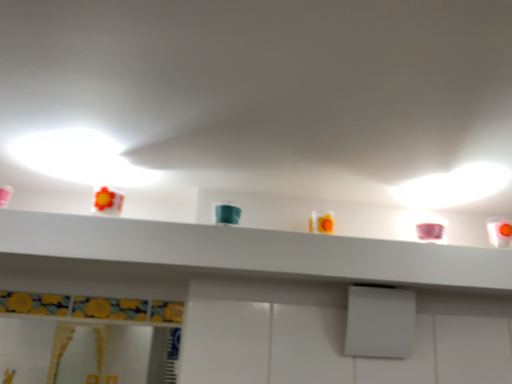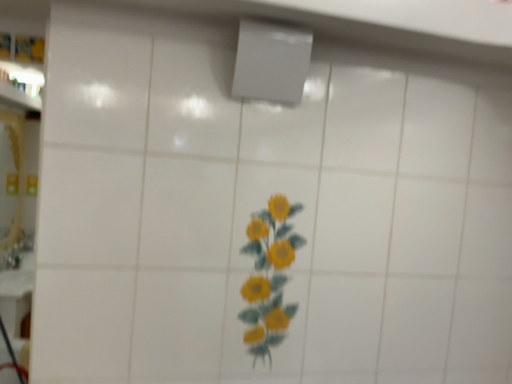
Question: How did the camera likely rotate when shooting the video?

Choices:
 (A) rotated left
 (B) rotated right

Answer: (B)